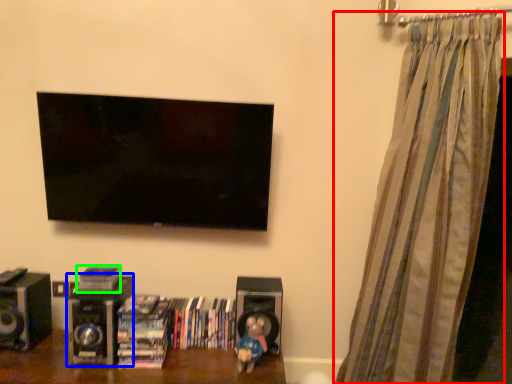
Question: Which object is positioned closest to curtain (highlighted by a red box)? Select from speaker (highlighted by a blue box) and book (highlighted by a green box).

Choices:
 (A) speaker
 (B) book

Answer: (A)